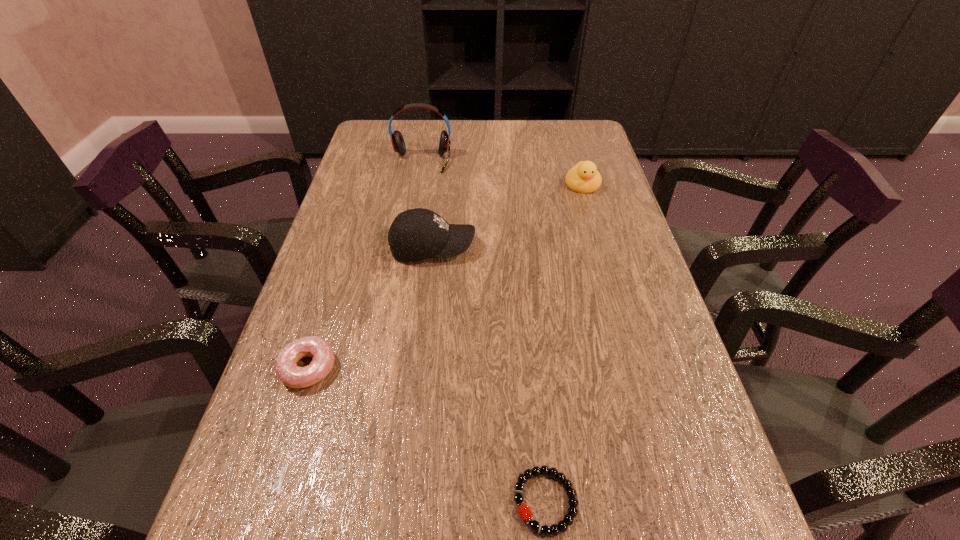
In order to click on blank space at the left edge of the desktop in this screenshot , I will do click(380, 260).

In the image, there is a desktop. What are the coordinates of `free region at the right edge` in the screenshot? It's located at (655, 306).

The height and width of the screenshot is (540, 960). Find the location of `vacant space at the far left corner`. vacant space at the far left corner is located at coordinates pos(373,151).

At what (x,y) coordinates should I click in order to perform the action: click on free space at the far right corner of the desktop. Please return your answer as a coordinate pair (x, y). Looking at the image, I should click on (590, 148).

You are a GUI agent. You are given a task and a screenshot of the screen. Output one action in this format:
    pyautogui.click(x=<x>, y=<y>)
    Task: Click on the blank region between the duckling and the shortest object
    The image size is (960, 540).
    Given the screenshot: What is the action you would take?
    pyautogui.click(x=564, y=343)

This screenshot has width=960, height=540. I want to click on free spot between the second shortest object and the duckling, so 445,276.

This screenshot has height=540, width=960. What are the coordinates of `free space between the baseball cap and the leftmost object` in the screenshot? It's located at (371, 308).

The height and width of the screenshot is (540, 960). Identify the location of vacant area that lies between the second tallest object and the leftmost object. (371, 308).

The image size is (960, 540). Find the location of `free point between the doughnut and the shortest object`. free point between the doughnut and the shortest object is located at coordinates (427, 435).

This screenshot has width=960, height=540. I want to click on vacant space that's between the fourth shortest object and the headset, so click(x=427, y=204).